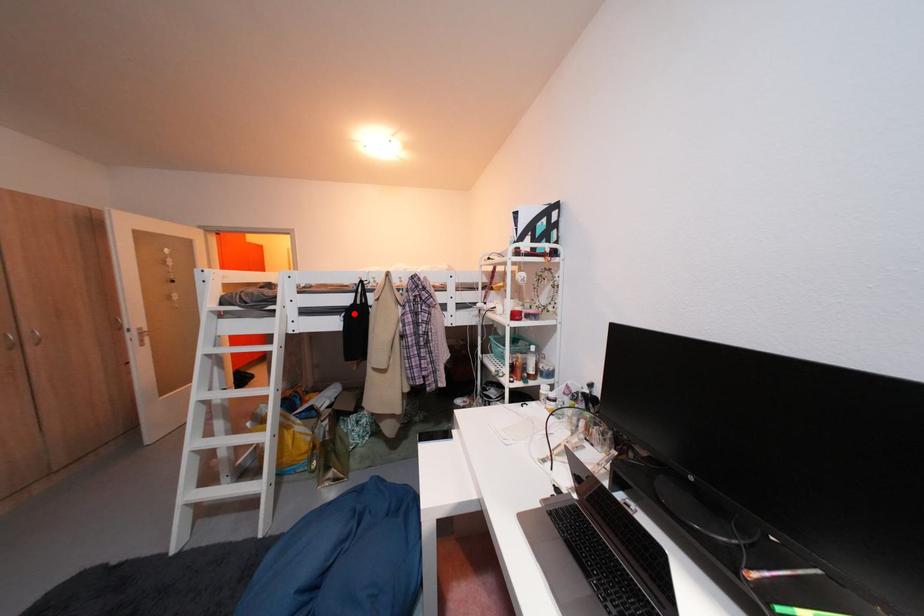
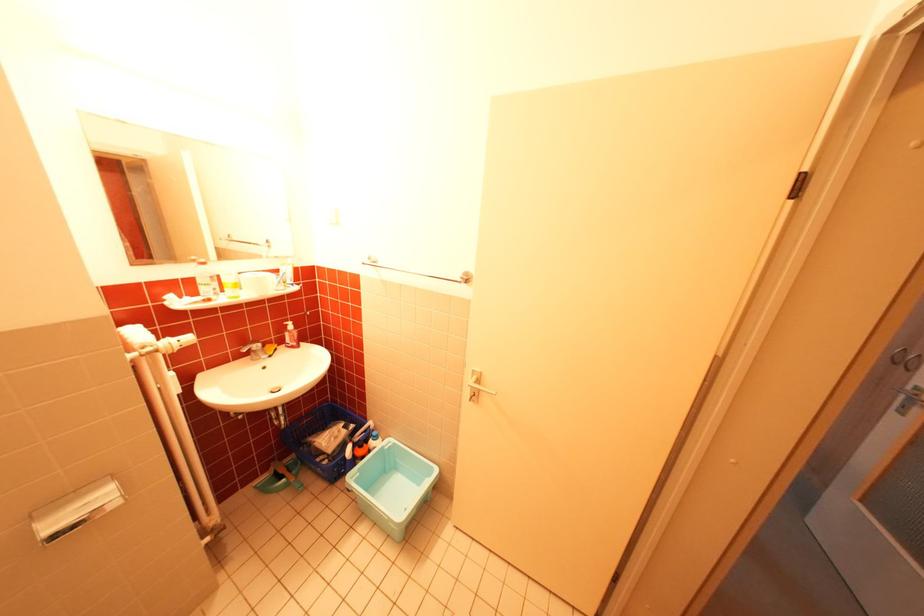
Question: I am providing you with two images of the same scene from different viewpoints. A red point is marked on the first image. Is the red point's position out of view in image 2?

Choices:
 (A) Yes
 (B) No

Answer: (A)